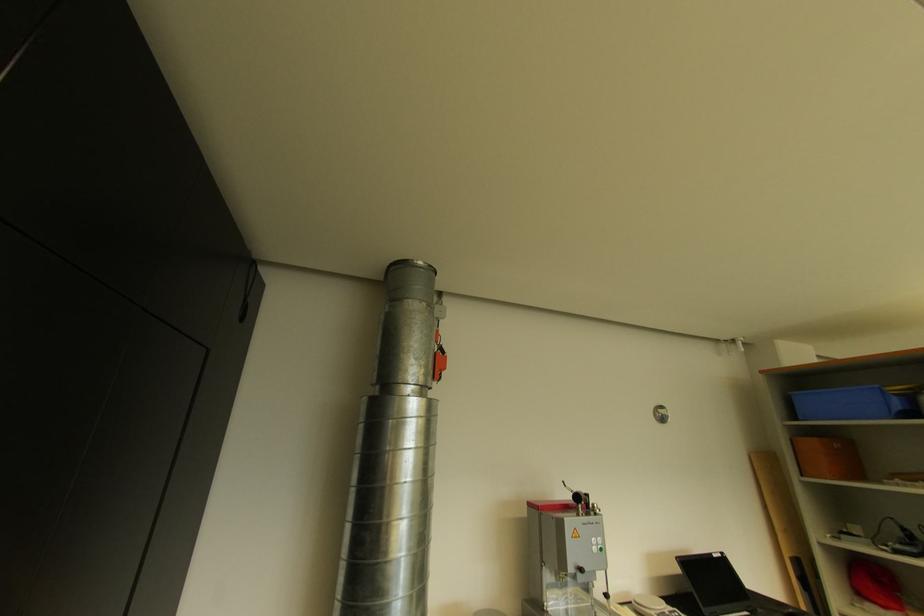
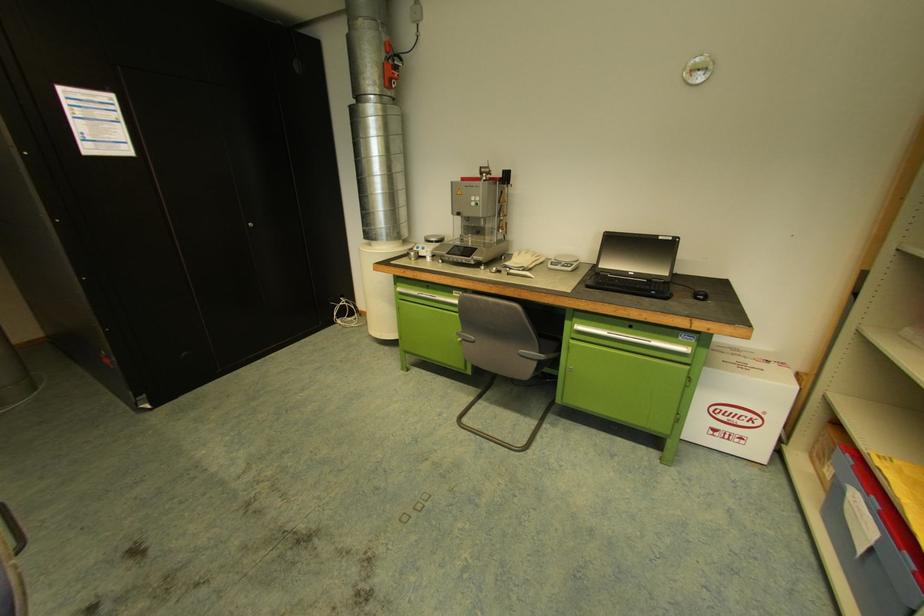
Locate, in the second image, the point that corresponds to (599,549) in the first image.

(477, 204)